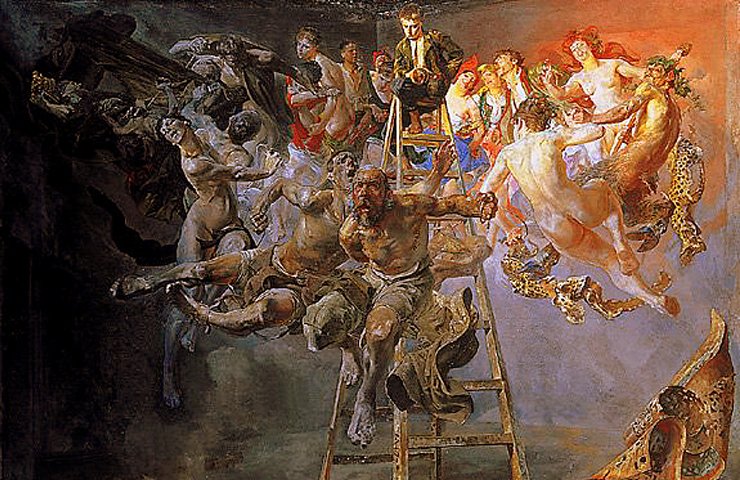
Image resolution: width=740 pixels, height=480 pixels. I want to click on orange paint, so click(x=707, y=28).